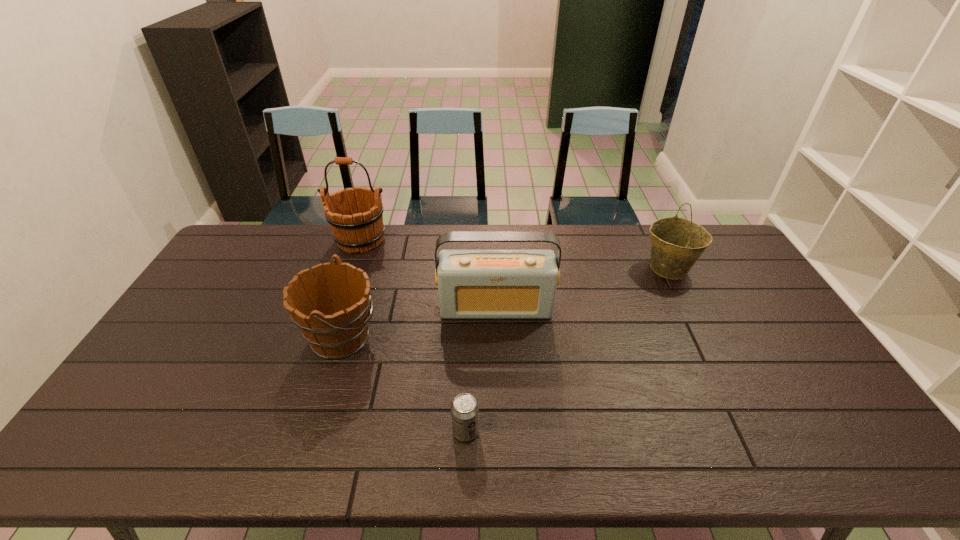
Locate an element on the screen. empty space between the rightmost object and the beer can is located at coordinates (567, 350).

Find the location of `free area in between the tallest object and the radio receiver`. free area in between the tallest object and the radio receiver is located at coordinates (428, 274).

Locate an element on the screen. Image resolution: width=960 pixels, height=540 pixels. free spot between the beer can and the rightmost wine bucket is located at coordinates (567, 350).

In order to click on vacant space that's between the shortest wine bucket and the radio receiver in this screenshot , I will do `click(419, 323)`.

The image size is (960, 540). Identify the location of blank region between the beer can and the tallest object. (413, 335).

Where is `empty space between the shortest wine bucket and the radio receiver`? This screenshot has width=960, height=540. empty space between the shortest wine bucket and the radio receiver is located at coordinates (419, 323).

What are the coordinates of `free spot between the radio receiver and the second shortest object` in the screenshot? It's located at (419, 323).

Locate which object is the fourth closest to the radio receiver. Please provide its 2D coordinates. Your answer should be formatted as a tuple, i.e. [(x, y)], where the tuple contains the x and y coordinates of a point satisfying the conditions above.

[(464, 409)]

I want to click on object that is the second closest one to the nearest wine bucket, so click(x=355, y=216).

Select which wine bucket is the closest to the tallest object. Please provide its 2D coordinates. Your answer should be formatted as a tuple, i.e. [(x, y)], where the tuple contains the x and y coordinates of a point satisfying the conditions above.

[(333, 335)]